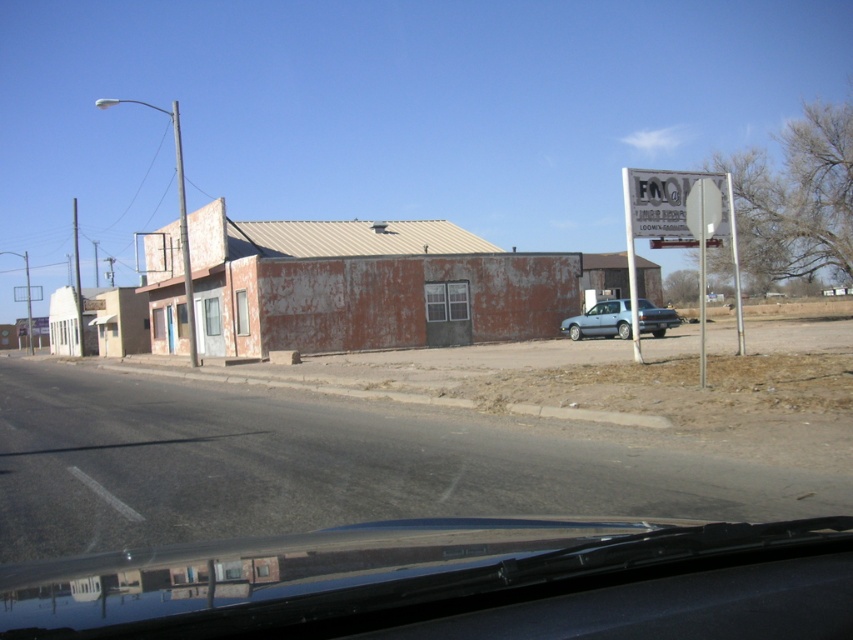
Question: Does transparent glass windshield at center lie behind white plastic sign at right?

Choices:
 (A) no
 (B) yes

Answer: (A)

Question: Considering the real-world distances, which object is closest to the satin silver sedan at center?

Choices:
 (A) white plastic sign at right
 (B) white plastic sign at upper right

Answer: (A)

Question: Which point appears farthest from the camera in this image?

Choices:
 (A) (688, 189)
 (B) (672, 189)
 (C) (616, 304)
 (D) (28, 595)

Answer: (C)

Question: Does transparent glass windshield at center come behind white plastic sign at right?

Choices:
 (A) yes
 (B) no

Answer: (B)

Question: Which point is farther from the camera taking this photo?

Choices:
 (A) (668, 198)
 (B) (639, 305)

Answer: (B)

Question: Does white plastic sign at right come behind satin silver sedan at center?

Choices:
 (A) yes
 (B) no

Answer: (B)